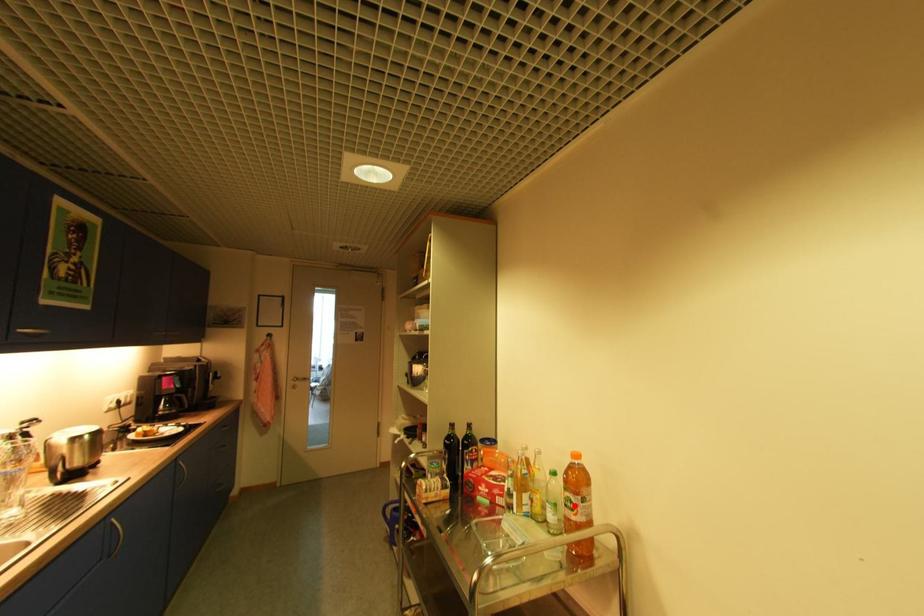
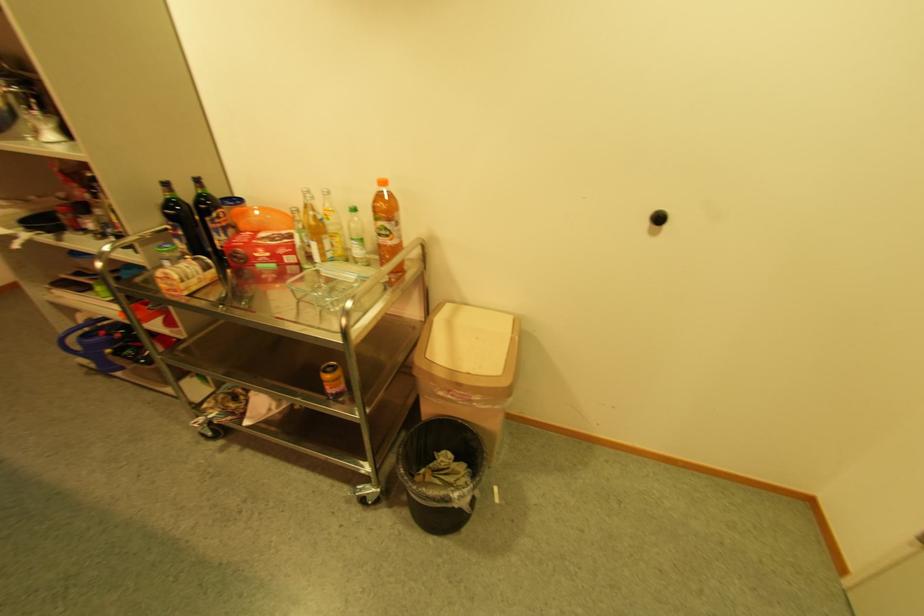
The point at the highlighted location is marked in the first image. Where is the corresponding point in the second image?

(391, 233)